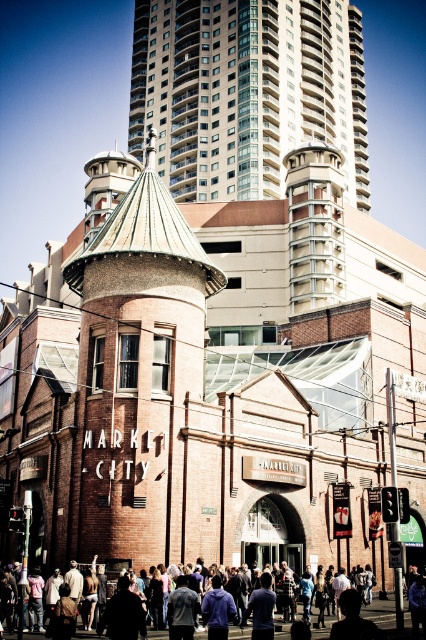
Question: Where is brick tower at center located in relation to dark blue shirt at center in the image?

Choices:
 (A) right
 (B) left

Answer: (B)

Question: Which point appears farthest from the camera in this image?

Choices:
 (A) (368, 614)
 (B) (164, 131)
 (C) (140, 209)

Answer: (B)

Question: Which of the following is the closest to the observer?

Choices:
 (A) white glass tower at upper center
 (B) dark blue shirt at center
 (C) brick tower at center

Answer: (B)

Question: Is brick tower at center above dark blue shirt at center?

Choices:
 (A) no
 (B) yes

Answer: (B)

Question: Can you confirm if brick tower at center is wider than dark blue shirt at center?

Choices:
 (A) yes
 (B) no

Answer: (B)

Question: Which object appears closest to the camera in this image?

Choices:
 (A) brick tower at center
 (B) dark blue shirt at center

Answer: (B)